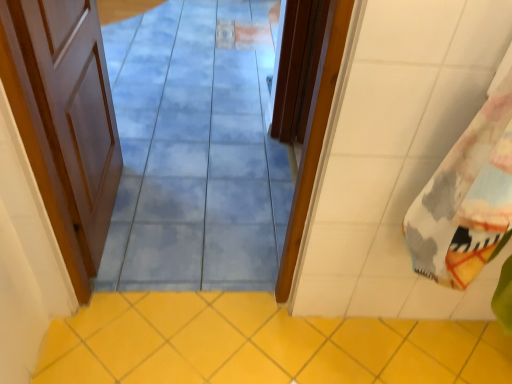
Question: Is white wood door at left, the 1th door viewed from the left, in contact with blue glossy tile at center?

Choices:
 (A) yes
 (B) no

Answer: (B)

Question: Is white wood door at left, which is the second door in right-to-left order, at the left side of blue glossy tile at center?

Choices:
 (A) yes
 (B) no

Answer: (A)

Question: Could you tell me if white wood door at left, the 1th door viewed from the left, is turned towards blue glossy tile at center?

Choices:
 (A) no
 (B) yes

Answer: (B)

Question: Is white wood door at left, the 1th door viewed from the left, positioned behind blue glossy tile at center?

Choices:
 (A) no
 (B) yes

Answer: (B)

Question: From a real-world perspective, is white wood door at left, the 1th door viewed from the left, under blue glossy tile at center?

Choices:
 (A) no
 (B) yes

Answer: (B)

Question: From a real-world perspective, is blue glossy tile at center above or below printed cotton beach towel at right?

Choices:
 (A) below
 (B) above

Answer: (A)

Question: From the image's perspective, is blue glossy tile at center located above or below printed cotton beach towel at right?

Choices:
 (A) above
 (B) below

Answer: (A)

Question: Looking at their shapes, would you say blue glossy tile at center is wider or thinner than printed cotton beach towel at right?

Choices:
 (A) wide
 (B) thin

Answer: (B)

Question: Relative to printed cotton beach towel at right, is blue glossy tile at center in front or behind?

Choices:
 (A) front
 (B) behind

Answer: (B)

Question: Is wooden door at center, the first door viewed from the right, wider or thinner than printed cotton beach towel at right?

Choices:
 (A) thin
 (B) wide

Answer: (A)

Question: From a real-world perspective, is wooden door at center, the first door viewed from the right, above or below printed cotton beach towel at right?

Choices:
 (A) above
 (B) below

Answer: (B)

Question: Does point (315, 92) appear closer or farther from the camera than point (461, 145)?

Choices:
 (A) farther
 (B) closer

Answer: (A)

Question: From the image's perspective, is wooden door at center, the first door viewed from the right, above or below printed cotton beach towel at right?

Choices:
 (A) above
 (B) below

Answer: (A)

Question: In the image, is yellow ceramic tile at lower center on the left side or the right side of printed cotton beach towel at right?

Choices:
 (A) left
 (B) right

Answer: (A)

Question: From the image's perspective, relative to printed cotton beach towel at right, is yellow ceramic tile at lower center above or below?

Choices:
 (A) below
 (B) above

Answer: (A)